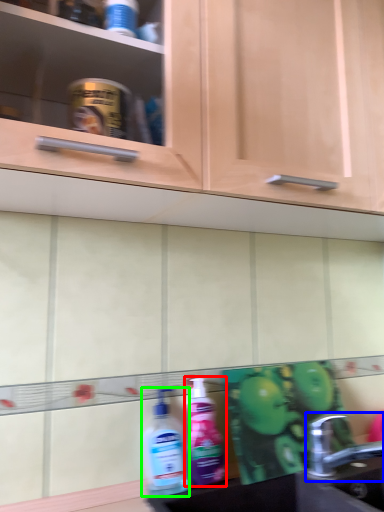
Question: Which object is the closest to the cleaning product (highlighted by a red box)? Choose among these: tap (highlighted by a blue box) or cleaning product (highlighted by a green box).

Choices:
 (A) tap
 (B) cleaning product

Answer: (B)